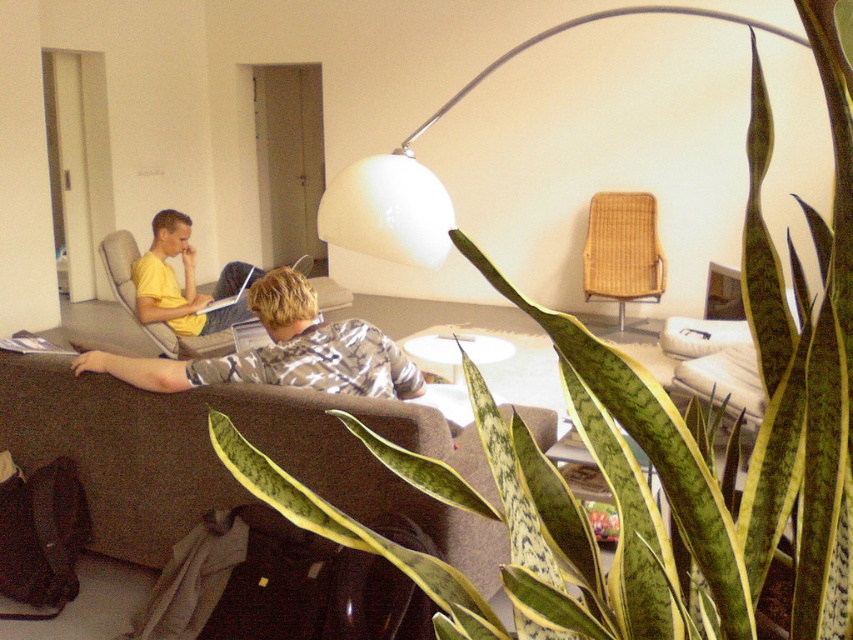
Question: Which point appears farthest from the camera in this image?

Choices:
 (A) (352, 202)
 (B) (132, 282)
 (C) (657, 264)
 (D) (375, 348)

Answer: (C)

Question: Is brown fabric couch at lower center smaller than silver metallic laptop at center?

Choices:
 (A) no
 (B) yes

Answer: (A)

Question: Does brown fabric couch at lower center appear on the left side of white glossy arc lamp at upper center?

Choices:
 (A) no
 (B) yes

Answer: (B)

Question: From the image, what is the correct spatial relationship of matte gray armchair at left in relation to silver metallic laptop at center?

Choices:
 (A) below
 (B) above

Answer: (A)

Question: Which object is closer to the camera taking this photo?

Choices:
 (A) matte gray armchair at left
 (B) white glossy arc lamp at upper center

Answer: (B)

Question: Among these objects, which one is nearest to the camera?

Choices:
 (A) woven wicker chair at center
 (B) matte gray armchair at left

Answer: (B)